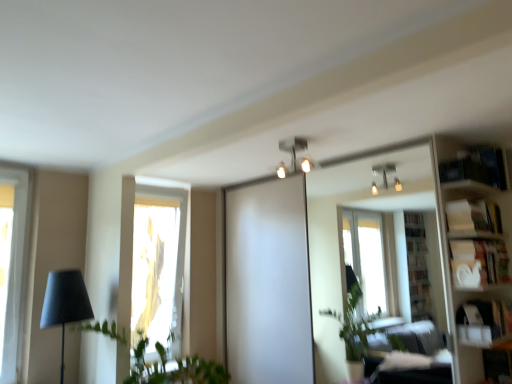
Question: From a real-world perspective, is white glossy bookshelf at right positioned over matte black lamp at left based on gravity?

Choices:
 (A) no
 (B) yes

Answer: (B)

Question: Can you confirm if white glossy bookshelf at right is wider than matte black lamp at left?

Choices:
 (A) no
 (B) yes

Answer: (A)

Question: From a real-world perspective, is white glossy bookshelf at right below matte black lamp at left?

Choices:
 (A) yes
 (B) no

Answer: (B)

Question: From the image's perspective, is white glossy bookshelf at right under matte black lamp at left?

Choices:
 (A) yes
 (B) no

Answer: (B)

Question: Does white glossy bookshelf at right touch matte black lamp at left?

Choices:
 (A) yes
 (B) no

Answer: (B)

Question: Is point (229, 377) closer or farther from the camera than point (480, 180)?

Choices:
 (A) farther
 (B) closer

Answer: (A)

Question: Do you think green leafy plant at left is within blue cardboard bookshelf at upper right, the third shelf positioned from the bottom, or outside of it?

Choices:
 (A) outside
 (B) inside

Answer: (A)

Question: From the image's perspective, is green leafy plant at left above or below blue cardboard bookshelf at upper right, the first shelf from the top?

Choices:
 (A) below
 (B) above

Answer: (A)

Question: Considering the positions of green leafy plant at left and blue cardboard bookshelf at upper right, the third shelf positioned from the bottom, in the image, is green leafy plant at left wider or thinner than blue cardboard bookshelf at upper right, the third shelf positioned from the bottom,?

Choices:
 (A) wide
 (B) thin

Answer: (A)

Question: Is translucent fabric at left bigger or smaller than white cardboard box at upper right, acting as the second shelf starting from the top?

Choices:
 (A) big
 (B) small

Answer: (A)

Question: Choose the correct answer: Is translucent fabric at left inside white cardboard box at upper right, positioned as the second shelf in bottom-to-top order, or outside it?

Choices:
 (A) outside
 (B) inside

Answer: (A)

Question: Does point coord(177,253) appear closer or farther from the camera than point coord(484,213)?

Choices:
 (A) closer
 (B) farther

Answer: (B)

Question: Considering their positions, is translucent fabric at left located in front of or behind white cardboard box at upper right, positioned as the second shelf in bottom-to-top order?

Choices:
 (A) behind
 (B) front

Answer: (A)

Question: From the image's perspective, relative to white matte bookshelf at right, the third shelf in the top-to-bottom sequence, is white glossy bookshelf at right above or below?

Choices:
 (A) above
 (B) below

Answer: (B)

Question: Considering the positions of point (439, 178) and point (498, 264), is point (439, 178) closer or farther from the camera than point (498, 264)?

Choices:
 (A) farther
 (B) closer

Answer: (A)